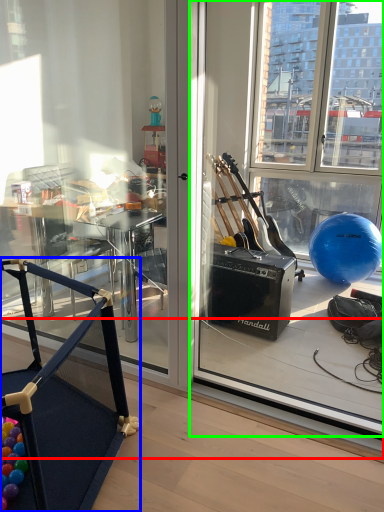
Question: Based on their relative distances, which object is farther from window sill (highlighted by a red box)? Choose from furniture (highlighted by a blue box) and window screen (highlighted by a green box).

Choices:
 (A) furniture
 (B) window screen

Answer: (B)